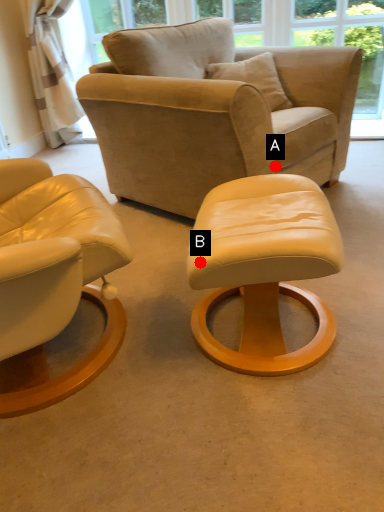
Question: Two points are circled on the image, labeled by A and B beside each circle. Which point is closer to the camera?

Choices:
 (A) A is closer
 (B) B is closer

Answer: (B)